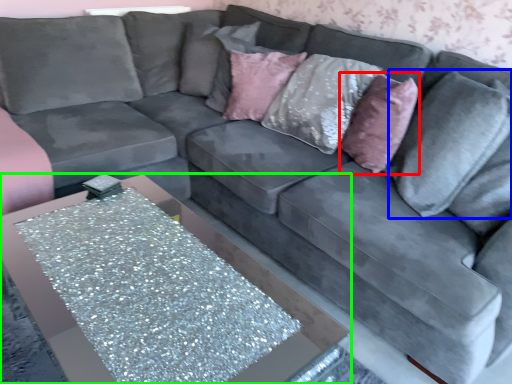
Question: Which object is positioned farthest from throw pillow (highlighted by a red box)? Select from pillow (highlighted by a blue box) and table (highlighted by a green box).

Choices:
 (A) pillow
 (B) table

Answer: (B)